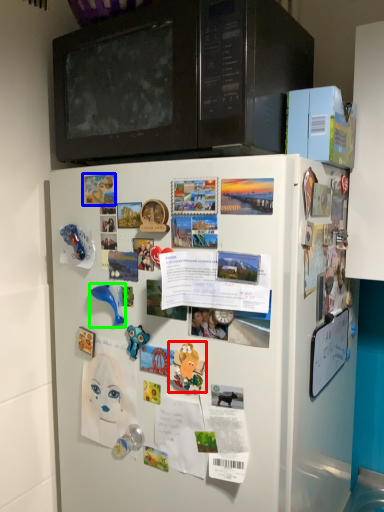
Question: Based on their relative distances, which object is nearer to toy (highlighted by a red box)? Choose from poster (highlighted by a blue box) and toy (highlighted by a green box).

Choices:
 (A) poster
 (B) toy

Answer: (B)